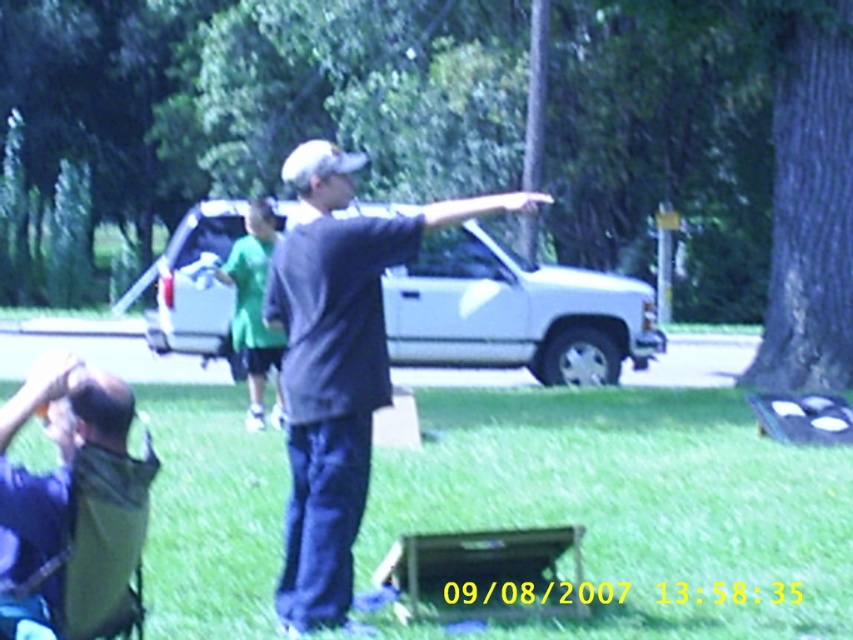
This screenshot has height=640, width=853. What do you see at coordinates (476, 131) in the screenshot?
I see `brown textured tree at center right` at bounding box center [476, 131].

Can you confirm if brown textured tree at center right is smaller than dark gray shirt at center?

No, brown textured tree at center right is not smaller than dark gray shirt at center.

This screenshot has height=640, width=853. Identify the location of brown textured tree at center right. (476, 131).

Find the location of a particular element. brown textured tree at center right is located at coordinates (476, 131).

Is dark gray shirt at center behind green fabric folding chair at lower left?

That is True.

Locate an element on the screen. The image size is (853, 640). dark gray shirt at center is located at coordinates (337, 365).

Does point (361, 339) come in front of point (148, 444)?

No.

Locate an element on the screen. The height and width of the screenshot is (640, 853). dark gray shirt at center is located at coordinates (337, 365).

Is point (724, 588) positioned in front of point (540, 196)?

No, it is behind (540, 196).

The height and width of the screenshot is (640, 853). Describe the element at coordinates (635, 506) in the screenshot. I see `green grass at lower center` at that location.

Locate an element on the screen. The height and width of the screenshot is (640, 853). green grass at lower center is located at coordinates (635, 506).